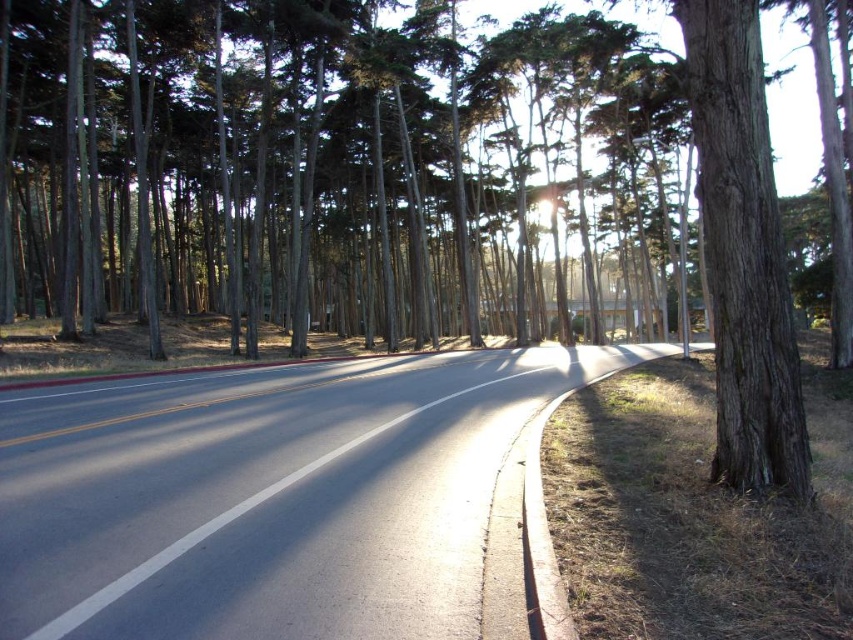
You are driving a car and want to park near the asphalt road at center. There is a brown rough bark tree at right nearby. Which object is closer to your car when parked?

The asphalt road at center is closer to the viewer than the brown rough bark tree at right, so when parked, the asphalt road at center will be closer to your car.

You are a pedestrian standing on the asphalt road at center. You want to reach the brown rough bark tree at right. Which direction should you walk to get closer to the tree?

The asphalt road at center is below the brown rough bark tree at right, so you should walk towards the right side of the road to reach the brown rough bark tree at right.